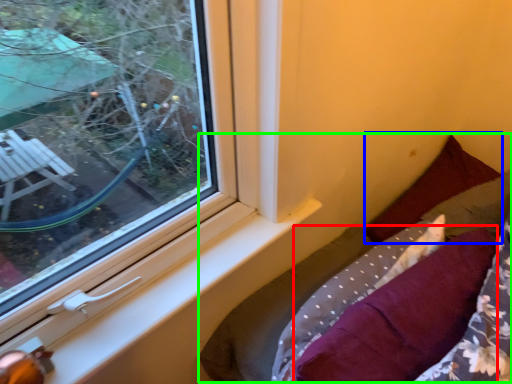
Question: Considering the real-world distances, which object is farthest from pillow (highlighted by a red box)? pillow (highlighted by a blue box) or bed (highlighted by a green box)?

Choices:
 (A) pillow
 (B) bed

Answer: (A)